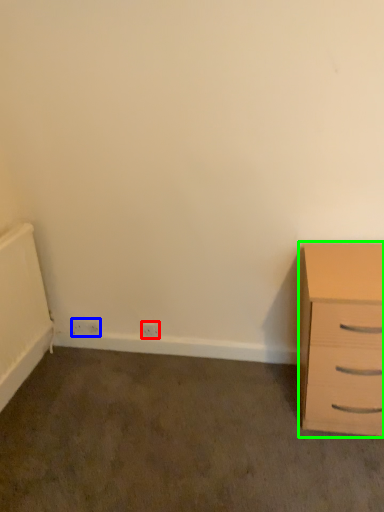
Question: Which is farther away from electric outlet (highlighted by a red box)? electric outlet (highlighted by a blue box) or chest of drawers (highlighted by a green box)?

Choices:
 (A) electric outlet
 (B) chest of drawers

Answer: (B)